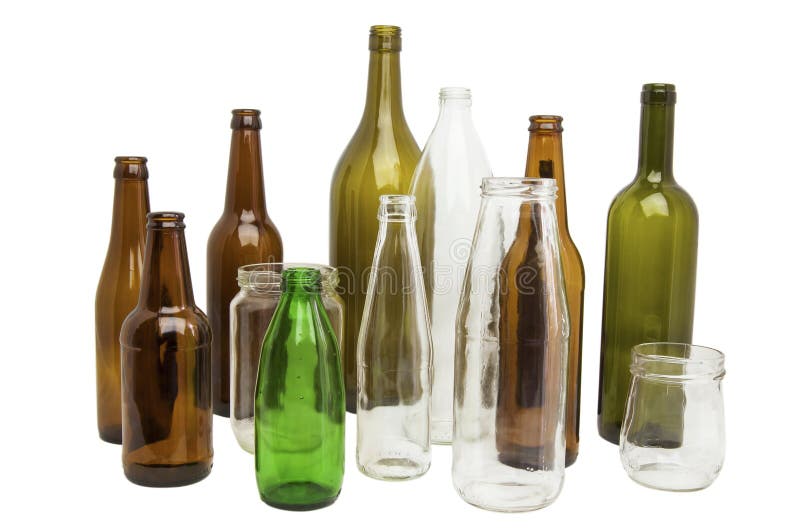
At what (x,y) coordinates should I click in order to perform the action: click on clear glass containers. Please return your answer as a coordinate pair (x, y). Looking at the image, I should click on (252, 322), (389, 318), (442, 242), (492, 295), (642, 415).